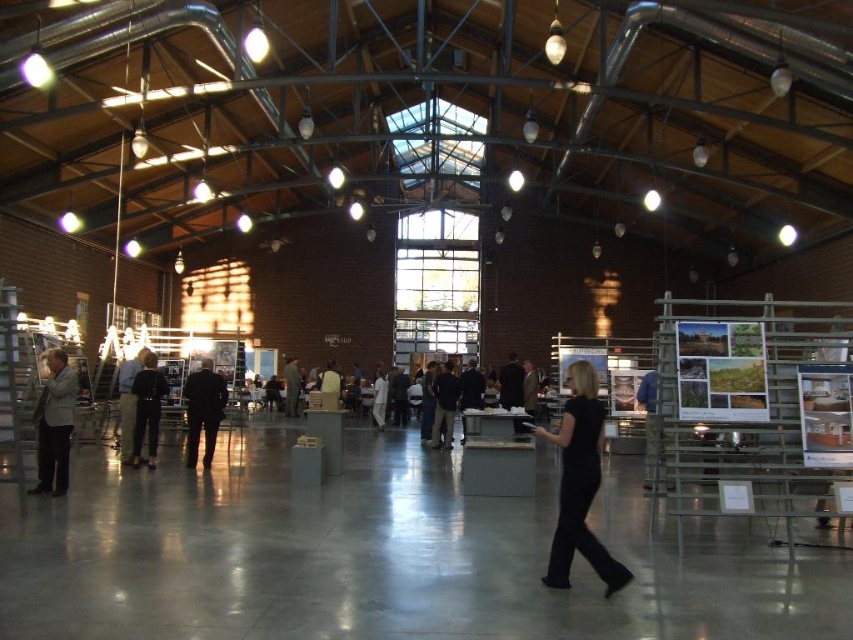
You are a photographer setting up a photoshoot in the industrial hall. You have a black matte dress at center and a black leather jacket at center. Which item should you move to ensure the other is fully visible in your camera frame?

Since the black matte dress at center is in front of the black leather jacket at center, you should move the black matte dress at center to reveal the black leather jacket at center in the frame.

You are organizing a fashion show in the industrial hall. You have two outfits displayed at the center of the hall. The black matte dress at center and the dark gray suit at center. Given that the runway is 1.2 meters wide, can both outfits be placed side by side without overlapping?

The black matte dress at center might be wider than dark gray suit at center. Since the runway is only 1.2 meters wide, there is a possibility that the black matte dress at center alone could exceed the width, making it uncertain if both can fit side by side without overlapping.